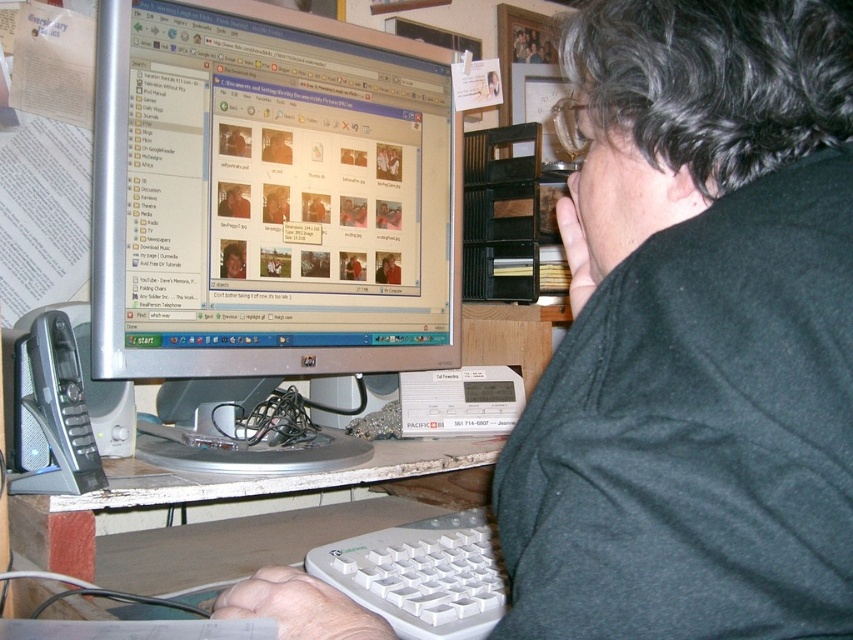
Question: Can you confirm if white plastic keyboard at lower center is wider than white plastic table at lower center?

Choices:
 (A) yes
 (B) no

Answer: (B)

Question: Which point is farther to the camera?

Choices:
 (A) silver metallic monitor at center
 (B) white plastic table at lower center

Answer: (A)

Question: Does silver metallic monitor at center appear on the right side of white plastic keyboard at lower center?

Choices:
 (A) yes
 (B) no

Answer: (B)

Question: Among these objects, which one is nearest to the camera?

Choices:
 (A) white plastic keyboard at lower center
 (B) white plastic table at lower center

Answer: (A)

Question: Is silver metallic monitor at center closer to the viewer compared to white plastic table at lower center?

Choices:
 (A) yes
 (B) no

Answer: (B)

Question: Which object is positioned farthest from the white plastic keyboard at lower center?

Choices:
 (A) silver metallic monitor at center
 (B) white plastic table at lower center

Answer: (A)